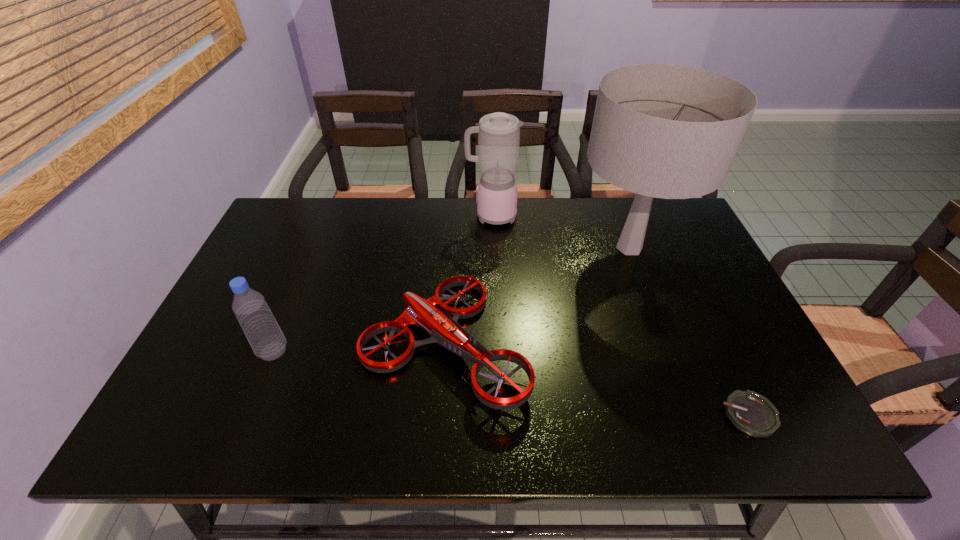
Identify the location of lampshade. (667, 131).

The width and height of the screenshot is (960, 540). I want to click on food processor, so click(498, 133).

Identify the location of the third tallest object. This screenshot has width=960, height=540. (257, 321).

You are a GUI agent. You are given a task and a screenshot of the screen. Output one action in this format:
    pyautogui.click(x=<x>, y=<y>)
    Task: Click on the leftmost object
    
    Given the screenshot: What is the action you would take?
    pyautogui.click(x=257, y=321)

Where is `drone`? The image size is (960, 540). drone is located at coordinates (445, 331).

Locate an element on the screen. the shortest object is located at coordinates (750, 412).

Image resolution: width=960 pixels, height=540 pixels. What are the coordinates of `vacant region located 0.190m on the front-facing side of the tallest object` in the screenshot? It's located at (509, 247).

What are the coordinates of `free location located 0.370m on the front-facing side of the tallest object` in the screenshot? It's located at (448, 247).

The width and height of the screenshot is (960, 540). Find the location of `vacant space located on the front-facing side of the tallest object`. vacant space located on the front-facing side of the tallest object is located at coordinates (492, 247).

Identify the location of free space located 0.080m on the base of the food processor near the control knob. (442, 216).